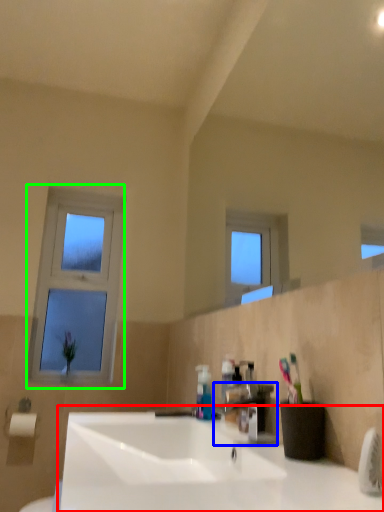
Question: Based on their relative distances, which object is farther from sink (highlighted by a red box)? Choose from tap (highlighted by a blue box) and window (highlighted by a green box).

Choices:
 (A) tap
 (B) window

Answer: (B)